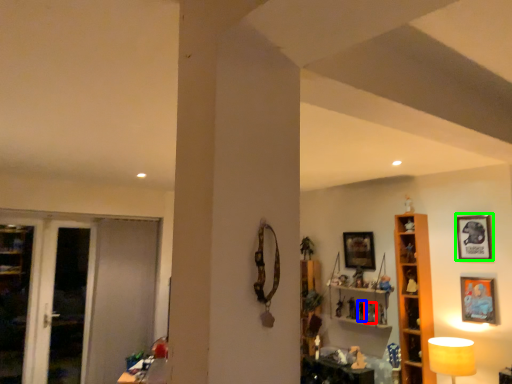
Question: Based on their relative distances, which object is nearer to toy (highlighted by a red box)? Choose from toy (highlighted by a blue box) and picture frame (highlighted by a green box).

Choices:
 (A) toy
 (B) picture frame

Answer: (A)